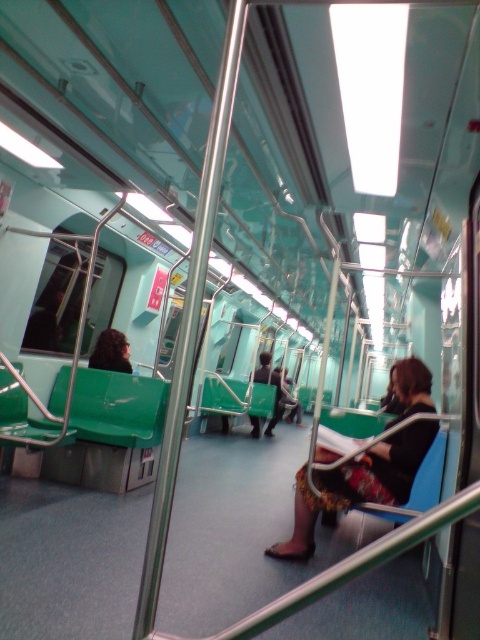
Question: Does black fabric skirt at center have a smaller size compared to curly brown hair at left?

Choices:
 (A) yes
 (B) no

Answer: (B)

Question: Considering the relative positions of black fabric skirt at center and curly brown hair at left in the image provided, where is black fabric skirt at center located with respect to curly brown hair at left?

Choices:
 (A) below
 (B) above

Answer: (A)

Question: Is black fabric skirt at center bigger than curly brown hair at left?

Choices:
 (A) no
 (B) yes

Answer: (B)

Question: Which object is closer to the camera taking this photo?

Choices:
 (A) curly brown hair at left
 (B) black fabric skirt at center

Answer: (B)